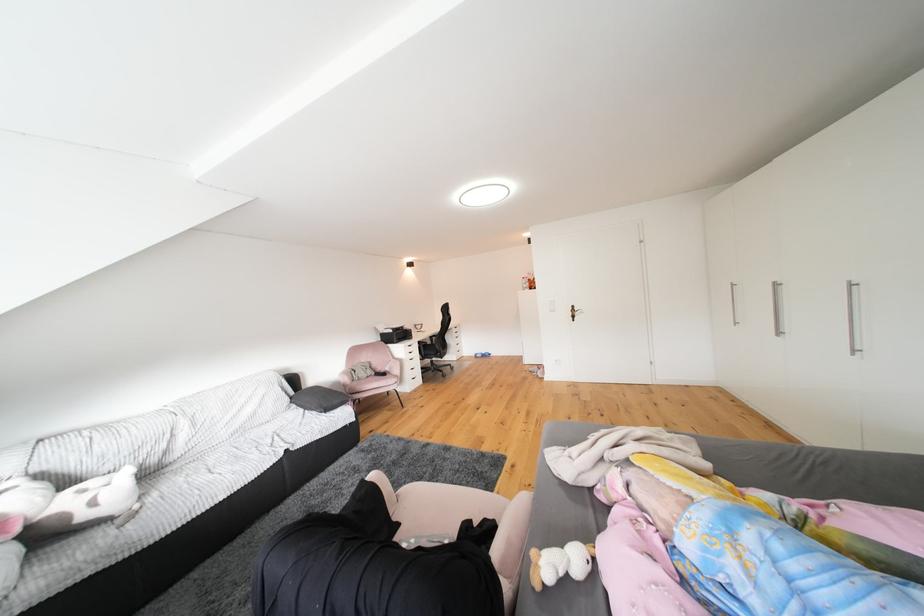
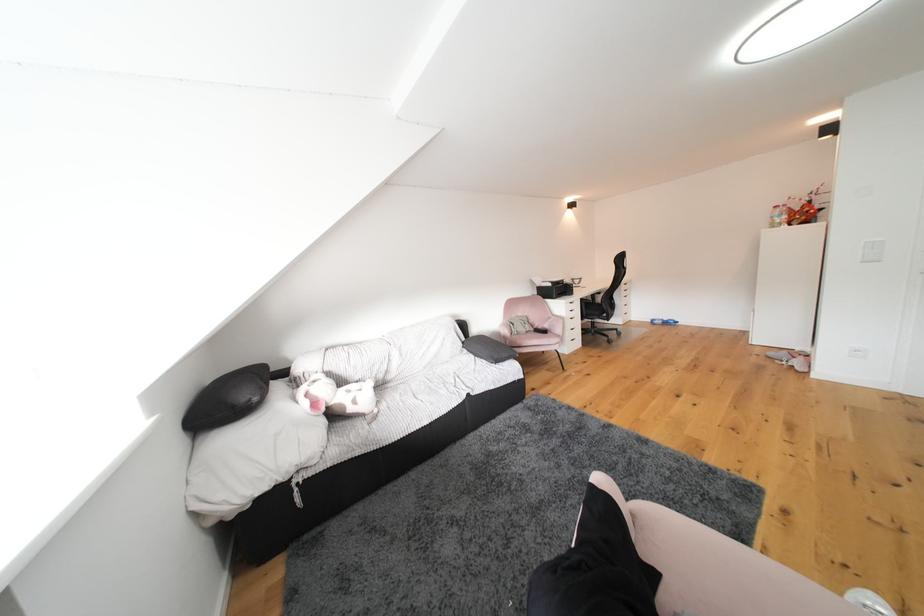
Question: The camera is either moving clockwise (left) or counter-clockwise (right) around the object. The first image is from the beginning of the video and the second image is from the end. Is the camera moving left or right when shooting the video?

Choices:
 (A) Left
 (B) Right

Answer: (B)